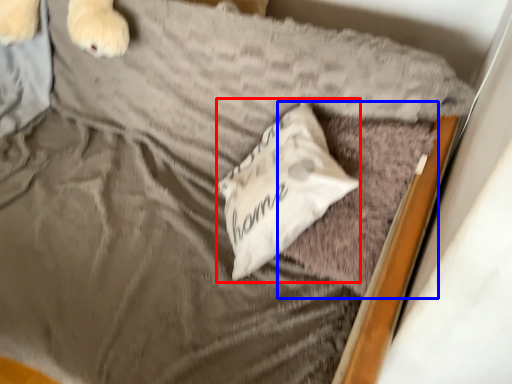
Question: Which object is further to the camera taking this photo, pillow (highlighted by a red box) or pillow (highlighted by a blue box)?

Choices:
 (A) pillow
 (B) pillow

Answer: (A)